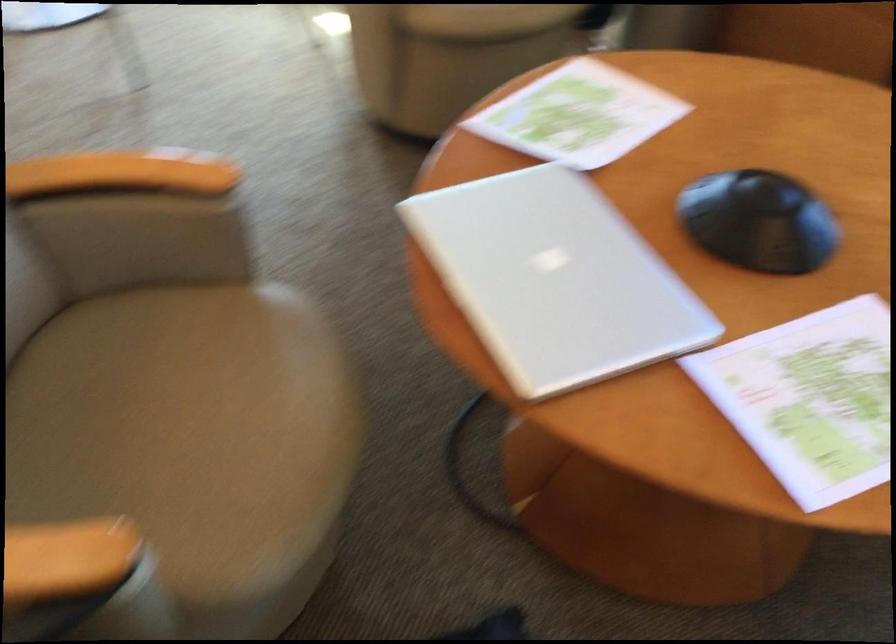
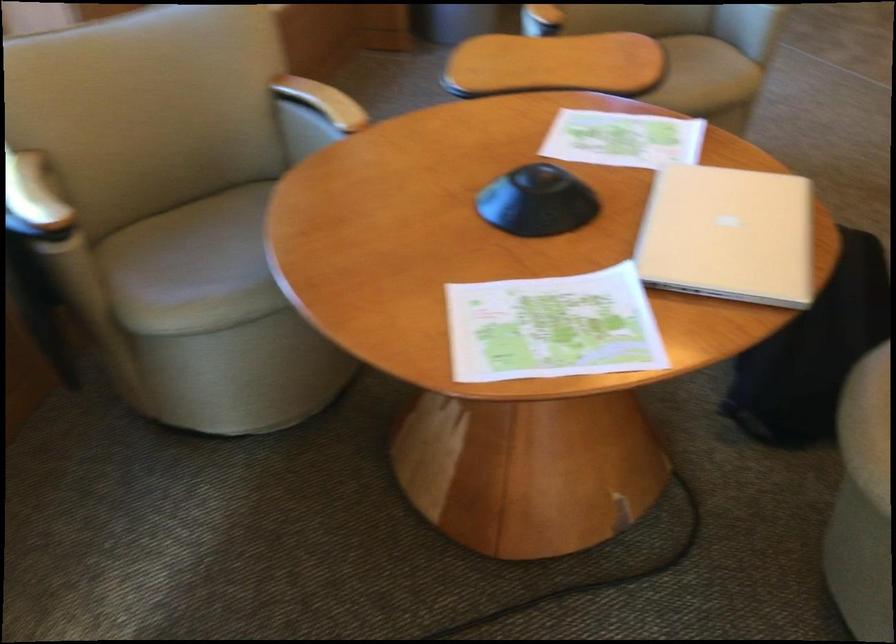
The point at (552, 164) is marked in the first image. Where is the corresponding point in the second image?

(552, 327)